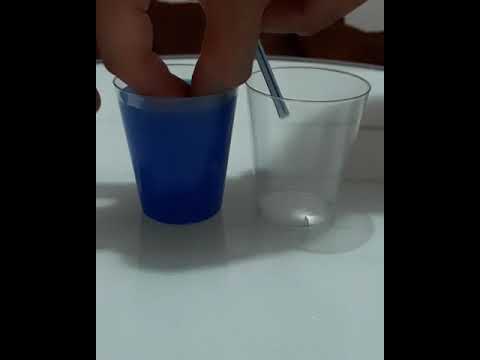
The image size is (480, 360). I want to click on edge of table, so click(x=352, y=62).